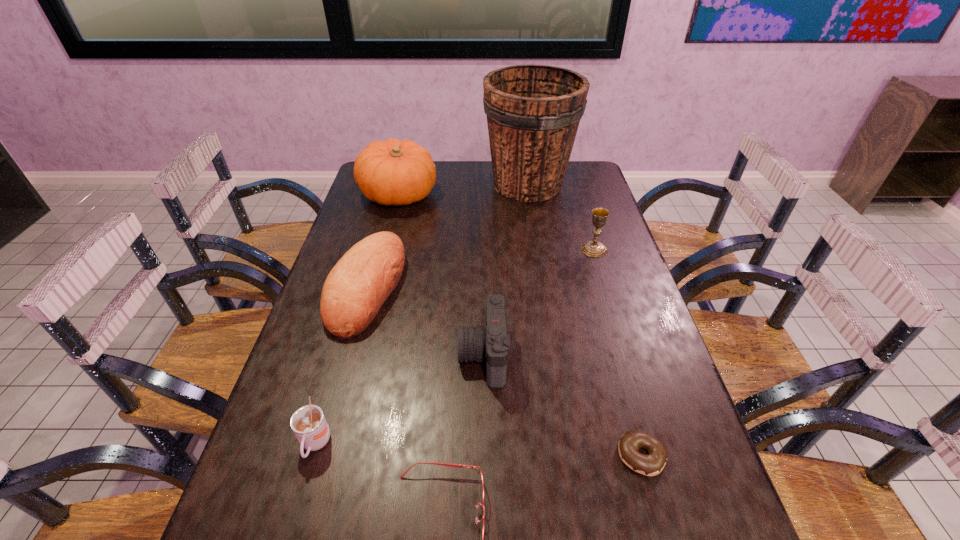
At what (x,y) coordinates should I click in order to perform the action: click on cup situated at the left edge. Please return your answer as a coordinate pair (x, y). Looking at the image, I should click on (308, 423).

Where is `bucket at the right edge`? bucket at the right edge is located at coordinates (533, 112).

Where is `chalice present at the right edge`? Image resolution: width=960 pixels, height=540 pixels. chalice present at the right edge is located at coordinates pos(593,248).

This screenshot has height=540, width=960. I want to click on doughnut located at the right edge, so click(651, 464).

Locate an element on the screen. This screenshot has height=540, width=960. object that is at the far left corner is located at coordinates (393, 172).

Where is `object that is positioned at the far right corner`? The image size is (960, 540). object that is positioned at the far right corner is located at coordinates (533, 112).

In the image, there is a desktop. What are the coordinates of `vacant region at the far edge` in the screenshot? It's located at [476, 178].

In the image, there is a desktop. Where is `vacant space at the left edge`? This screenshot has width=960, height=540. vacant space at the left edge is located at coordinates (326, 338).

The height and width of the screenshot is (540, 960). In the image, there is a desktop. What are the coordinates of `free region at the right edge` in the screenshot? It's located at [628, 303].

You are a GUI agent. You are given a task and a screenshot of the screen. Output one action in this format:
    pyautogui.click(x=<x>, y=<y>)
    Task: Click on the free space between the bread and the chalice
    
    Given the screenshot: What is the action you would take?
    pyautogui.click(x=480, y=268)